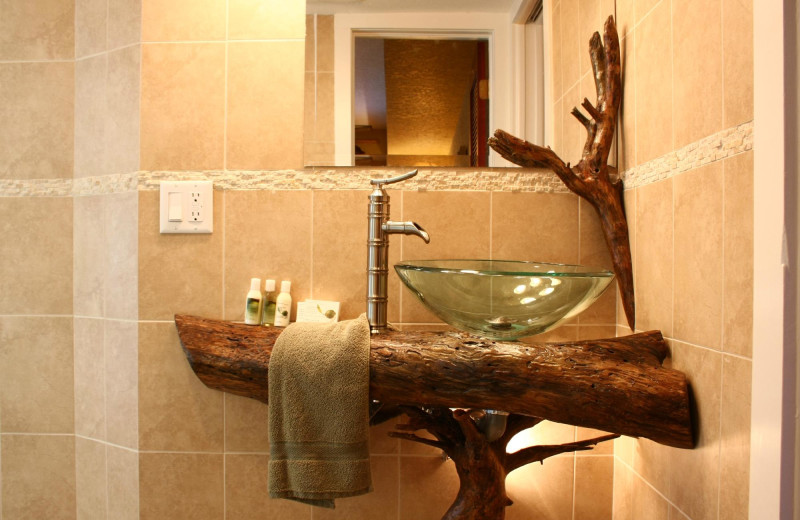
Find the location of `sink bowl`. sink bowl is located at coordinates (492, 300).